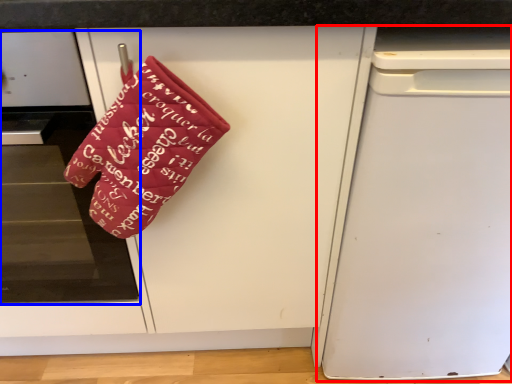
Question: Which point is closer to the camera, dish washer (highlighted by a red box) or home appliance (highlighted by a blue box)?

Choices:
 (A) dish washer
 (B) home appliance

Answer: (B)